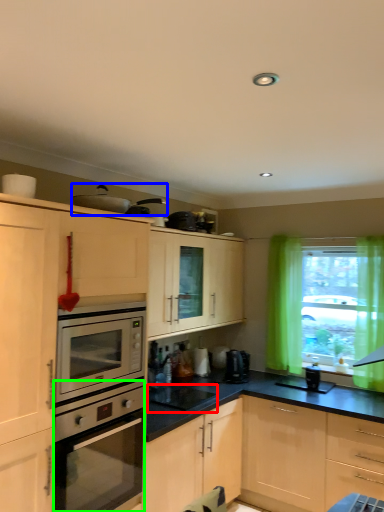
Question: Considering the real-world distances, which object is closest to appliance (highlighted by a red box)? appliance (highlighted by a blue box) or oven (highlighted by a green box).

Choices:
 (A) appliance
 (B) oven

Answer: (B)